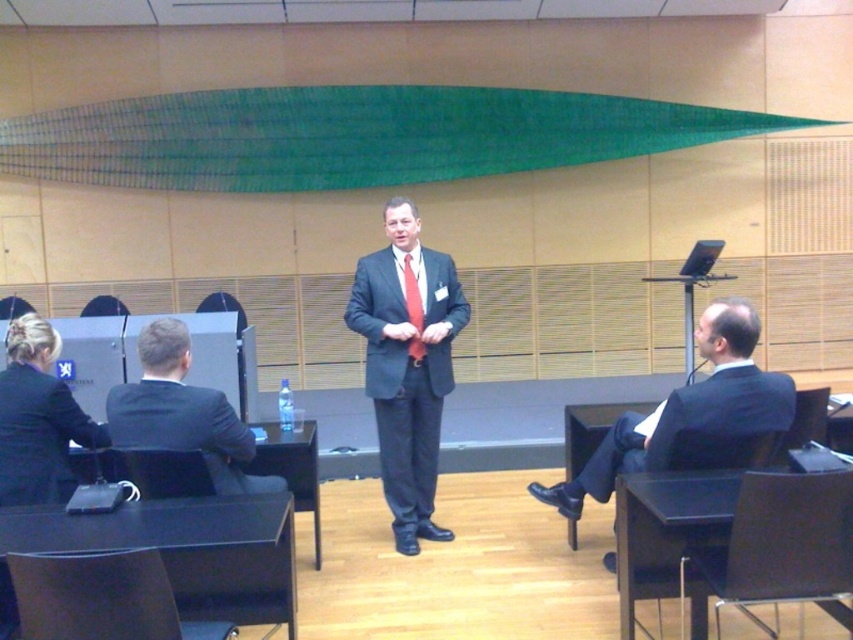
Question: Does black suit at right appear on the left side of black suit at left?

Choices:
 (A) no
 (B) yes

Answer: (A)

Question: Is matte black suit at center closer to the viewer compared to black suit at left?

Choices:
 (A) no
 (B) yes

Answer: (A)

Question: Can you confirm if brown leather chair at lower left is positioned below red silk tie at center?

Choices:
 (A) no
 (B) yes

Answer: (B)

Question: Among these points, which one is farthest from the camera?

Choices:
 (A) (195, 412)
 (B) (410, 522)

Answer: (B)

Question: Which of the following is the closest to the observer?

Choices:
 (A) (146, 397)
 (B) (392, 336)
 (C) (410, 284)

Answer: (A)

Question: Which of the following is the closest to the observer?

Choices:
 (A) matte black suit at center
 (B) red silk tie at center

Answer: (A)